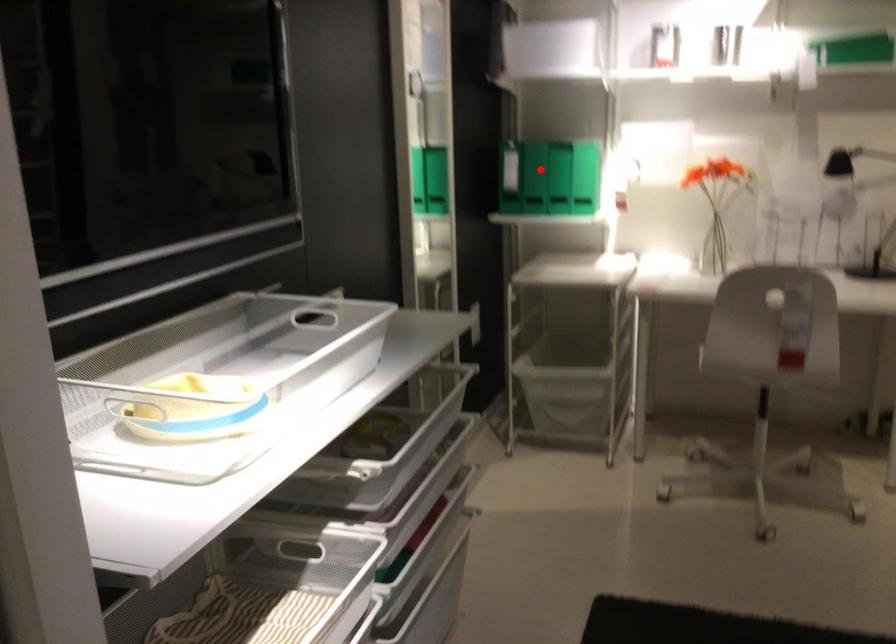
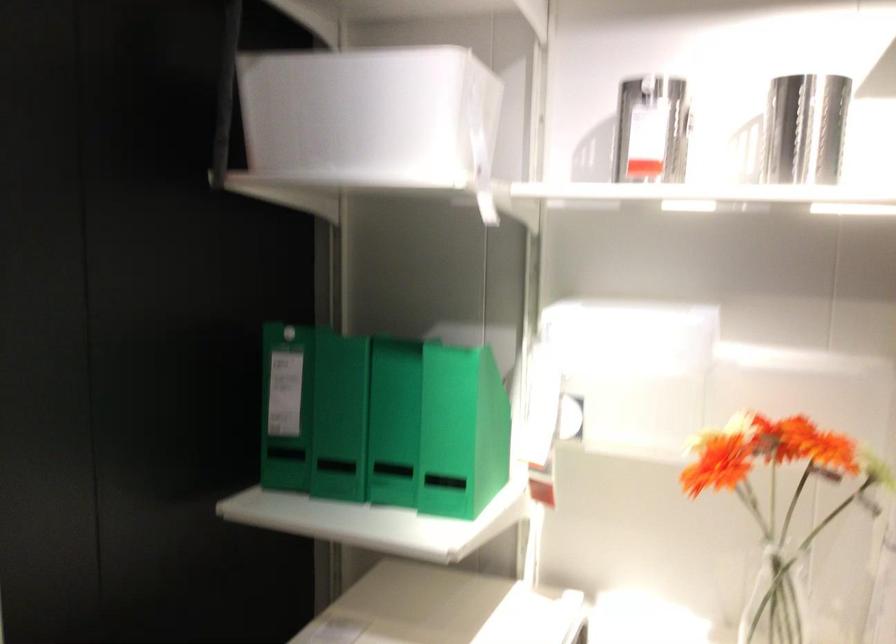
Find the pixel in the second image that matches the highlighted location in the first image.

(339, 417)